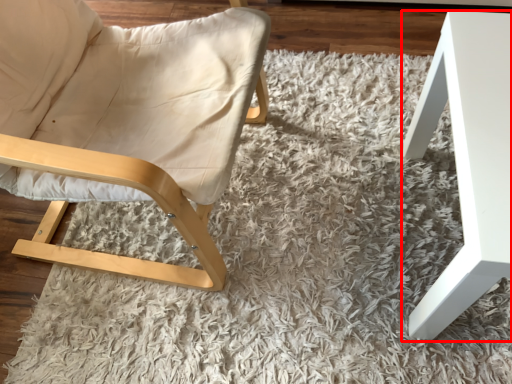
Question: From the image's perspective, what is the correct spatial positioning of table (annotated by the red box) in reference to chair?

Choices:
 (A) above
 (B) below

Answer: (B)